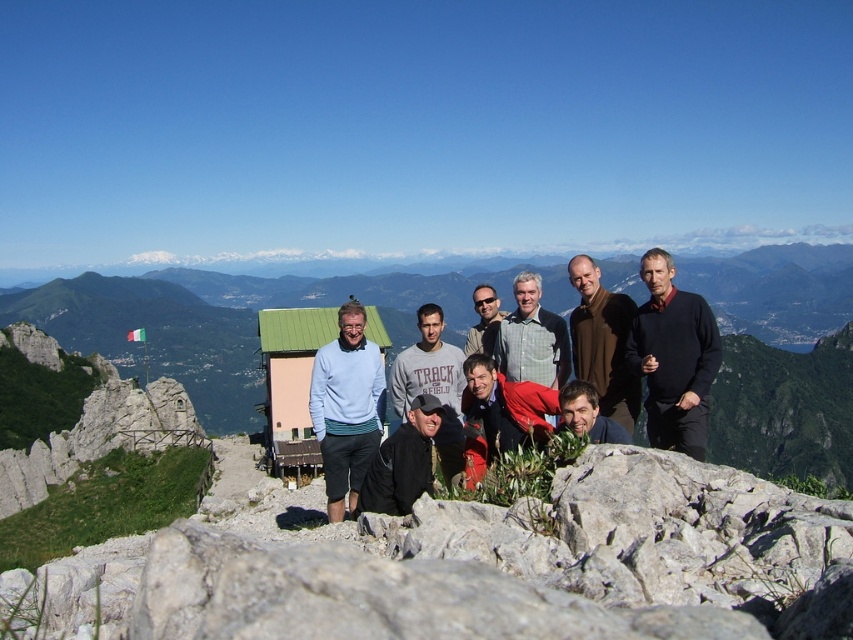
Question: In this image, where is light brown sweater at center located relative to dark brown leather jacket at center?

Choices:
 (A) above
 (B) below

Answer: (A)

Question: Is black cotton shirt at center positioned at the back of gray cotton sweatshirt at center?

Choices:
 (A) yes
 (B) no

Answer: (B)

Question: Which object is positioned farthest from the black cotton shirt at center?

Choices:
 (A) dark brown leather jacket at center
 (B) brown wool sweater at center

Answer: (A)

Question: Which of the following is the closest to the observer?

Choices:
 (A) matte gray jacket at center
 (B) white rough stone at center
 (C) light brown sweater at center
 (D) gray cotton sweatshirt at center

Answer: (B)

Question: Can you confirm if white rough stone at center is smaller than light blue sweater at center?

Choices:
 (A) yes
 (B) no

Answer: (B)

Question: Considering the real-world distances, which object is farthest from the white rough stone at center?

Choices:
 (A) light blue sweater at center
 (B) black cotton shirt at center
 (C) matte gray jacket at center

Answer: (C)